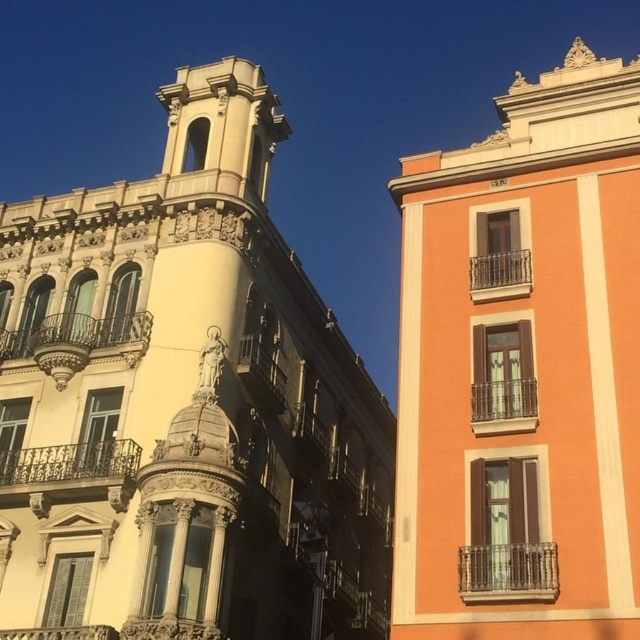
Who is positioned more to the left, matte gold bell tower at center or matte orange building at upper right?

Positioned to the left is matte gold bell tower at center.

Is matte gold bell tower at center to the right of matte orange building at upper right from the viewer's perspective?

No, matte gold bell tower at center is not to the right of matte orange building at upper right.

Locate an element on the screen. The image size is (640, 640). matte gold bell tower at center is located at coordinates (184, 404).